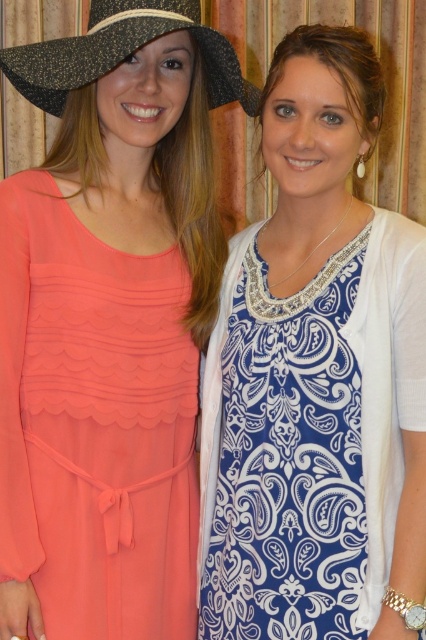
Question: Is coral chiffon dress at left above speckled fabric cowboy hat at upper left?

Choices:
 (A) no
 (B) yes

Answer: (A)

Question: Estimate the real-world distances between objects in this image. Which object is farther from the speckled fabric cowboy hat at upper left?

Choices:
 (A) coral chiffon dress at left
 (B) blue printed dress at center

Answer: (A)

Question: Where is blue printed dress at center located in relation to speckled fabric cowboy hat at upper left in the image?

Choices:
 (A) left
 (B) right

Answer: (B)

Question: Considering the real-world distances, which object is closest to the coral chiffon dress at left?

Choices:
 (A) blue printed dress at center
 (B) speckled fabric cowboy hat at upper left

Answer: (A)

Question: Which of the following is the closest to the observer?

Choices:
 (A) coral chiffon dress at left
 (B) speckled fabric cowboy hat at upper left

Answer: (B)

Question: In this image, where is coral chiffon dress at left located relative to speckled fabric cowboy hat at upper left?

Choices:
 (A) left
 (B) right

Answer: (A)